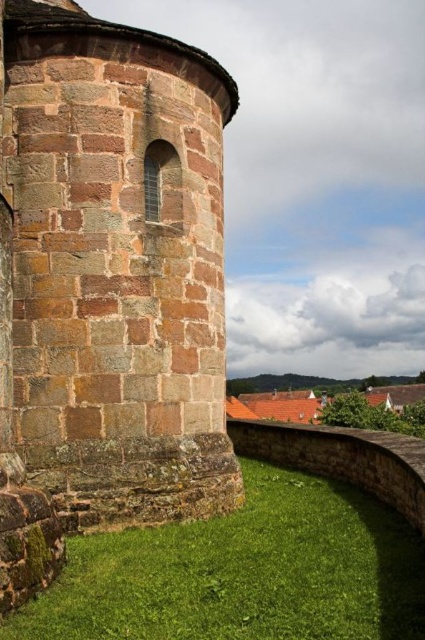
Does point (22, 365) lie behind point (274, 566)?

Yes, it is behind point (274, 566).

Does brown stone tower at left have a greater width compared to green grass at lower center?

No, brown stone tower at left is not wider than green grass at lower center.

At what (x,y) coordinates should I click in order to perform the action: click on brown stone tower at left. Please return your answer as a coordinate pair (x, y). The image size is (425, 640). Looking at the image, I should click on (107, 284).

Locate an element on the screen. brown stone tower at left is located at coordinates (107, 284).